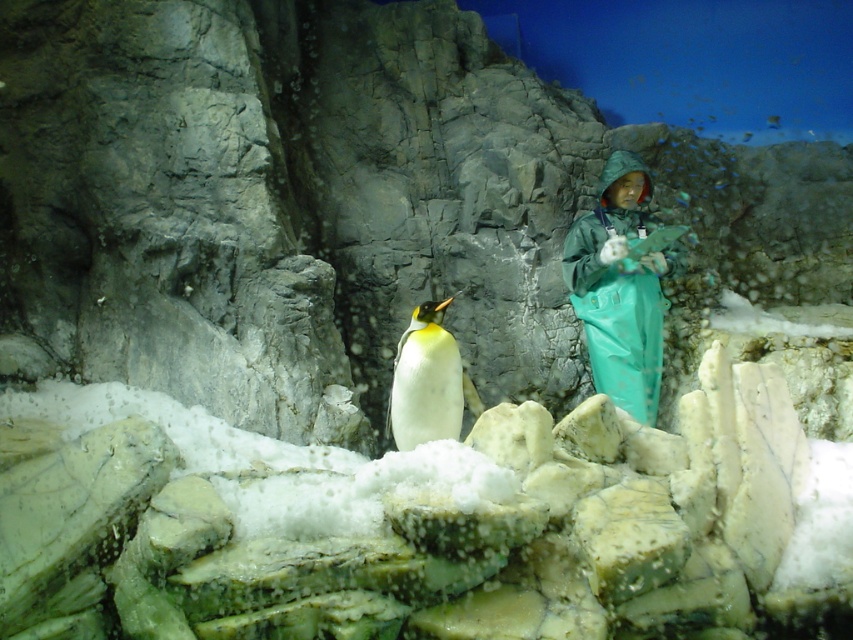
You are a visitor observing the penguin habitat. You see the green rubber suit at center and the white matte penguin at center. Which object is positioned to the right of the other?

The green rubber suit at center is to the right of the white matte penguin at center.

You are a visitor observing the penguin habitat. You see the green rubber suit at center and the white matte penguin at center. Which one is closer to you?

The green rubber suit at center is closer to you because the white matte penguin at center is behind it.

You are a zookeeper preparing to feed the penguin. You are standing next to the green rubber suit at center and the white matte penguin at center. Which of the two has a greater width?

The green rubber suit at center has a greater width than the white matte penguin at center according to the description.